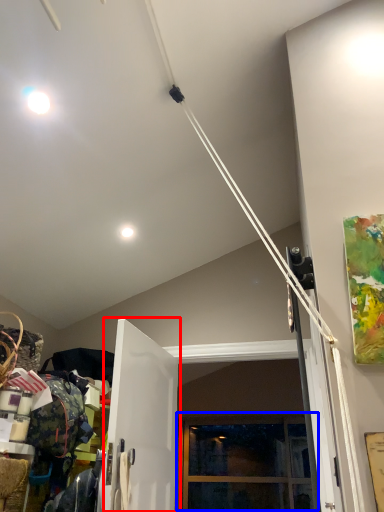
Question: Which object appears closest to the camera in this image, door (highlighted by a red box) or window (highlighted by a blue box)?

Choices:
 (A) door
 (B) window

Answer: (A)